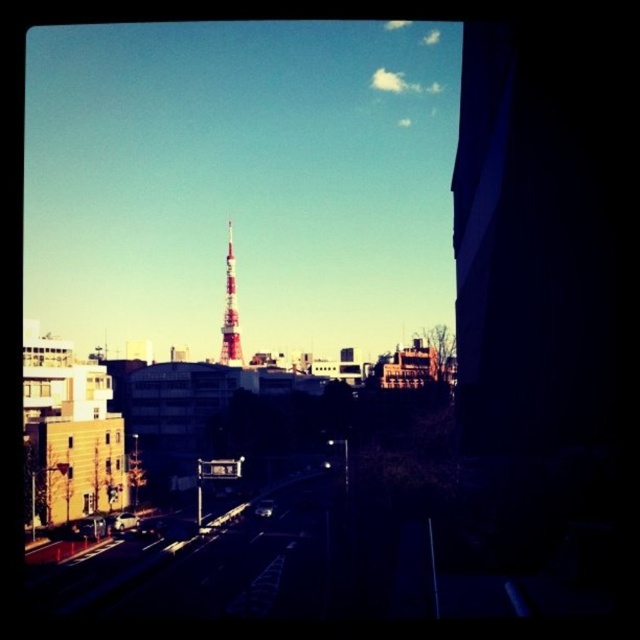
What do you see at coordinates (124, 566) in the screenshot? The image size is (640, 640). I see `smooth asphalt road at lower left` at bounding box center [124, 566].

How much distance is there between smooth asphalt road at lower left and red painted metal tower at center?

smooth asphalt road at lower left and red painted metal tower at center are 109.58 meters apart.

Find the location of a particular element. smooth asphalt road at lower left is located at coordinates (124, 566).